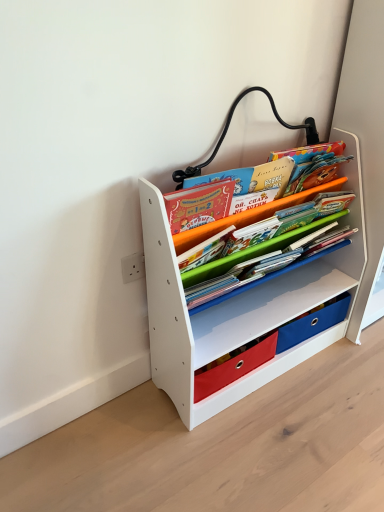
You are a GUI agent. You are given a task and a screenshot of the screen. Output one action in this format:
    pyautogui.click(x=<x>, y=<y>)
    Task: Click on the empty space that is to the right of white matte bookshelf at center
    This screenshot has height=512, width=384.
    Given the screenshot: What is the action you would take?
    pos(339,376)